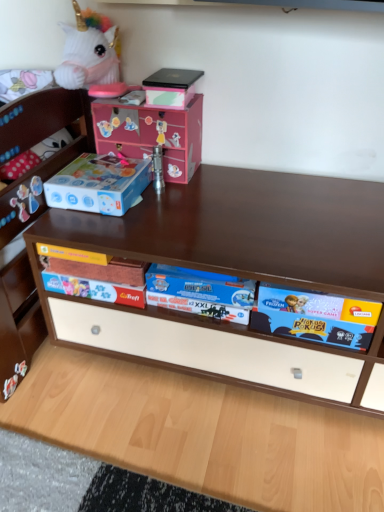
Question: Is the position of matte black box at upper center more distant than that of blue cardboard storage box at left?

Choices:
 (A) no
 (B) yes

Answer: (B)

Question: Is matte black box at upper center smaller than blue cardboard storage box at left?

Choices:
 (A) no
 (B) yes

Answer: (B)

Question: From the image's perspective, would you say matte black box at upper center is positioned over blue cardboard storage box at left?

Choices:
 (A) yes
 (B) no

Answer: (A)

Question: Considering the relative sizes of matte black box at upper center and blue cardboard storage box at left in the image provided, is matte black box at upper center taller than blue cardboard storage box at left?

Choices:
 (A) no
 (B) yes

Answer: (A)

Question: Could you tell me if matte black box at upper center is facing blue cardboard storage box at left?

Choices:
 (A) yes
 (B) no

Answer: (B)

Question: From a real-world perspective, is matte black box at upper center above or below blue cardboard game box at center?

Choices:
 (A) above
 (B) below

Answer: (A)

Question: Based on their sizes in the image, would you say matte black box at upper center is bigger or smaller than blue cardboard game box at center?

Choices:
 (A) small
 (B) big

Answer: (A)

Question: From the image's perspective, relative to blue cardboard game box at center, is matte black box at upper center above or below?

Choices:
 (A) below
 (B) above

Answer: (B)

Question: Is matte black box at upper center in front of or behind blue cardboard game box at center in the image?

Choices:
 (A) behind
 (B) front

Answer: (A)

Question: Looking at the image, does blue cardboard storage box at left seem bigger or smaller compared to blue cardboard game box at center?

Choices:
 (A) small
 (B) big

Answer: (A)

Question: In terms of height, does blue cardboard storage box at left look taller or shorter compared to blue cardboard game box at center?

Choices:
 (A) tall
 (B) short

Answer: (B)

Question: Considering their positions, is blue cardboard storage box at left located in front of or behind blue cardboard game box at center?

Choices:
 (A) behind
 (B) front

Answer: (A)

Question: From a real-world perspective, is blue cardboard storage box at left positioned above or below blue cardboard game box at center?

Choices:
 (A) below
 (B) above

Answer: (B)

Question: Is blue cardboard storage box at left wider or thinner than matte black box at upper center?

Choices:
 (A) thin
 (B) wide

Answer: (B)

Question: Considering the positions of blue cardboard storage box at left and matte black box at upper center in the image, is blue cardboard storage box at left bigger or smaller than matte black box at upper center?

Choices:
 (A) big
 (B) small

Answer: (A)